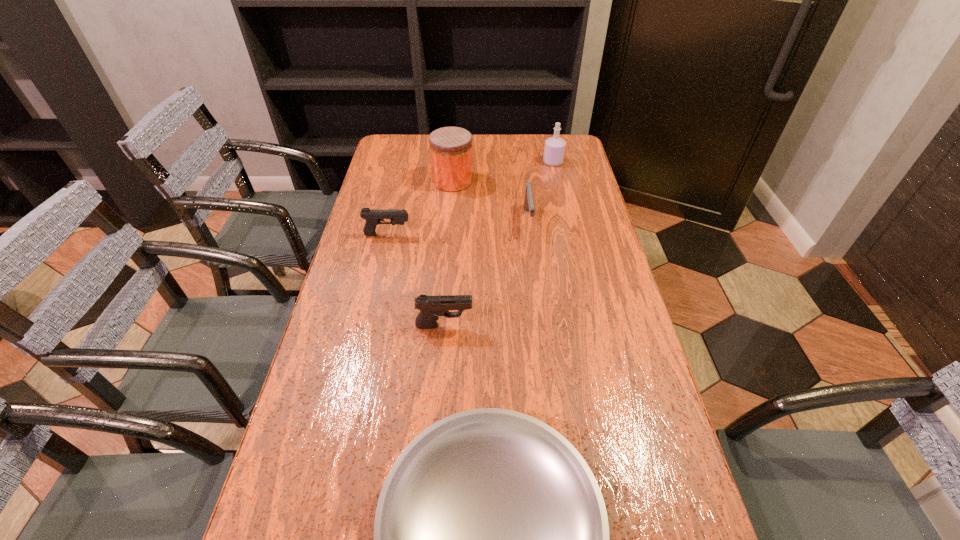
Find the location of a particular element. Image resolution: width=960 pixels, height=540 pixels. object that ranks as the closest to the leftmost object is located at coordinates (450, 147).

Point out which object is positioned as the third nearest to the rightmost pistol. Please provide its 2D coordinates. Your answer should be formatted as a tuple, i.e. [(x, y)], where the tuple contains the x and y coordinates of a point satisfying the conditions above.

[(373, 217)]

Locate which pistol is the closest to the second nearest object. Please provide its 2D coordinates. Your answer should be formatted as a tuple, i.e. [(x, y)], where the tuple contains the x and y coordinates of a point satisfying the conditions above.

[(373, 217)]

Select which pistol is the second closest to the rightmost pistol. Please provide its 2D coordinates. Your answer should be formatted as a tuple, i.e. [(x, y)], where the tuple contains the x and y coordinates of a point satisfying the conditions above.

[(430, 307)]

You are a GUI agent. You are given a task and a screenshot of the screen. Output one action in this format:
    pyautogui.click(x=<x>, y=<y>)
    Task: Click on the vacant region that satisfies the following two spatial constraints: 1. on the front side of the perfume; 2. at the barrel of the fifth farthest object
    The image size is (960, 540).
    Given the screenshot: What is the action you would take?
    pyautogui.click(x=589, y=325)

At what (x,y) coordinates should I click in order to perform the action: click on free spot that satisfies the following two spatial constraints: 1. on the front side of the jar; 2. at the barrel of the leftmost object. Please return your answer as a coordinate pair (x, y). Looking at the image, I should click on (448, 235).